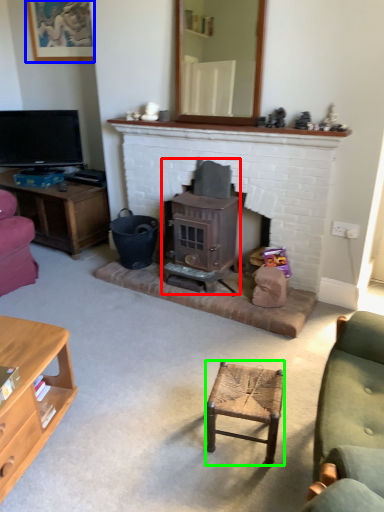
Question: Which is nearer to the wood burning stove (highlighted by a red box)? picture frame (highlighted by a blue box) or stool (highlighted by a green box).

Choices:
 (A) picture frame
 (B) stool

Answer: (B)